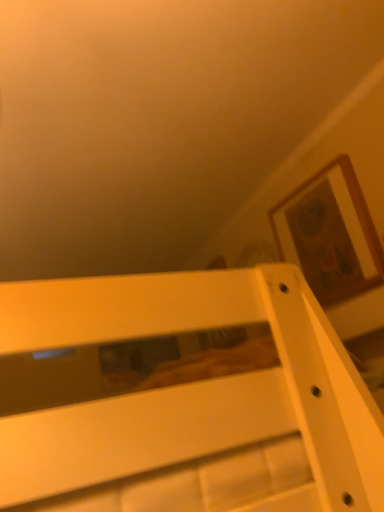
Identify the location of wooden picture frame at upper right. (330, 234).

Consider the image. Measure the distance between point (330, 199) and camera.

Point (330, 199) is 4.20 feet away from camera.

The width and height of the screenshot is (384, 512). What do you see at coordinates (330, 234) in the screenshot?
I see `wooden picture frame at upper right` at bounding box center [330, 234].

This screenshot has width=384, height=512. I want to click on wooden picture frame at upper right, so click(330, 234).